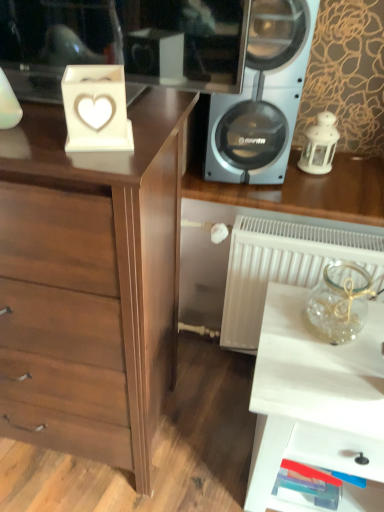
At what (x,y) coordinates should I click in order to perform the action: click on free space in front of white porcelain lantern at right. Please return your answer as a coordinate pair (x, y). The image size is (384, 512). Looking at the image, I should click on (323, 182).